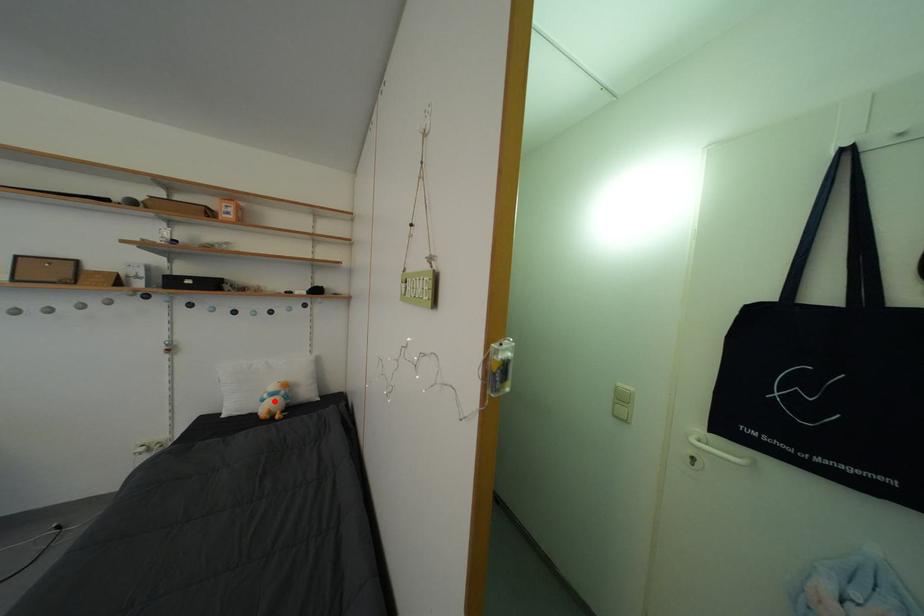
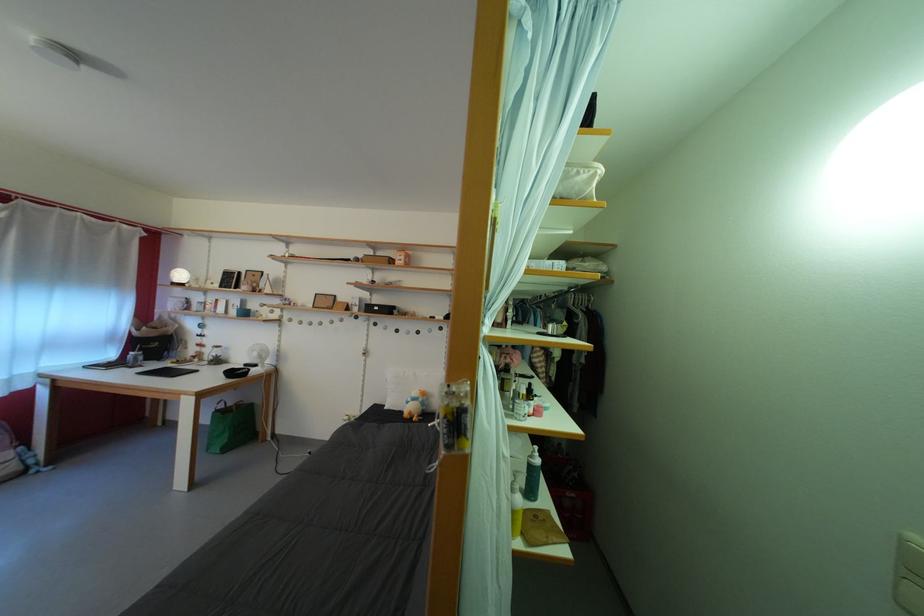
The point at the highlighted location is marked in the first image. Where is the corresponding point in the second image?

(418, 405)